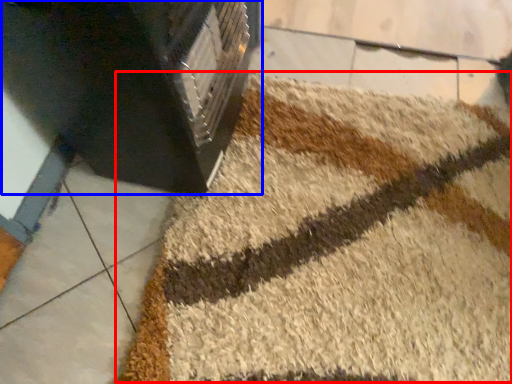
Question: Among these objects, which one is farthest to the camera, bath mat (highlighted by a red box) or furniture (highlighted by a blue box)?

Choices:
 (A) bath mat
 (B) furniture

Answer: (A)